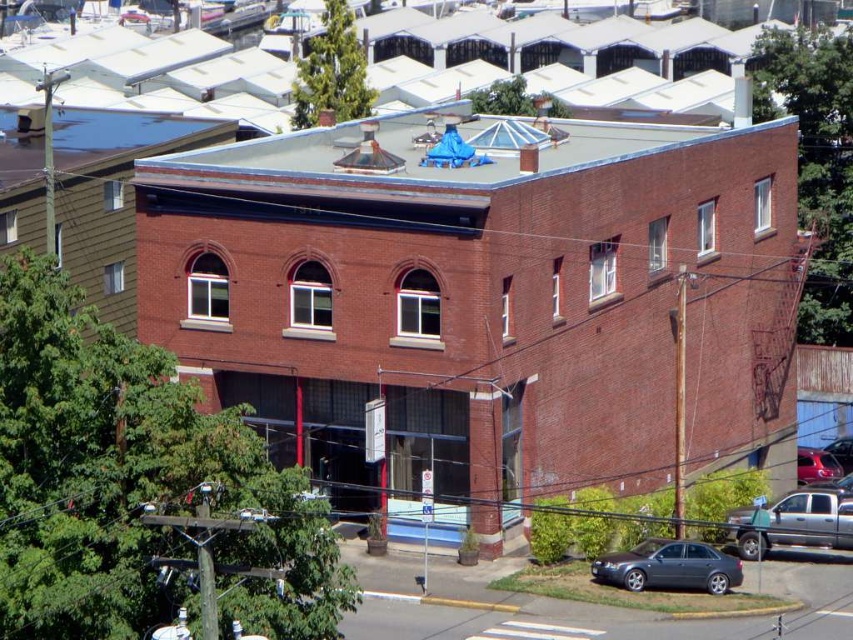
Who is more forward, (786, 513) or (840, 467)?

Point (786, 513) is more forward.

What do you see at coordinates (810, 518) in the screenshot? The image size is (853, 640). I see `silver metallic truck at lower right` at bounding box center [810, 518].

Who is more distant from viewer, (799, 504) or (808, 460)?

Positioned behind is point (808, 460).

The image size is (853, 640). I want to click on silver metallic truck at lower right, so click(x=810, y=518).

Is metallic gray sedan at lower right taller than shiny red car at lower right?

Correct, metallic gray sedan at lower right is much taller as shiny red car at lower right.

Does metallic gray sedan at lower right appear on the right side of shiny red car at lower right?

No, metallic gray sedan at lower right is not to the right of shiny red car at lower right.

Describe the element at coordinates (668, 566) in the screenshot. I see `metallic gray sedan at lower right` at that location.

You are a GUI agent. You are given a task and a screenshot of the screen. Output one action in this format:
    pyautogui.click(x=<x>, y=<y>)
    Task: Click on the metallic gray sedan at lower right
    This screenshot has height=640, width=853.
    Given the screenshot: What is the action you would take?
    pyautogui.click(x=668, y=566)

Can you confirm if metallic gray sedan at lower right is positioned below silver metallic truck at lower right?

Indeed, metallic gray sedan at lower right is positioned under silver metallic truck at lower right.

Consider the image. Who is positioned more to the left, metallic gray sedan at lower right or silver metallic truck at lower right?

From the viewer's perspective, metallic gray sedan at lower right appears more on the left side.

Does point (701, 552) come in front of point (802, 492)?

Yes, point (701, 552) is in front of point (802, 492).

Find the location of a particular element. This screenshot has height=640, width=853. metallic gray sedan at lower right is located at coordinates (668, 566).